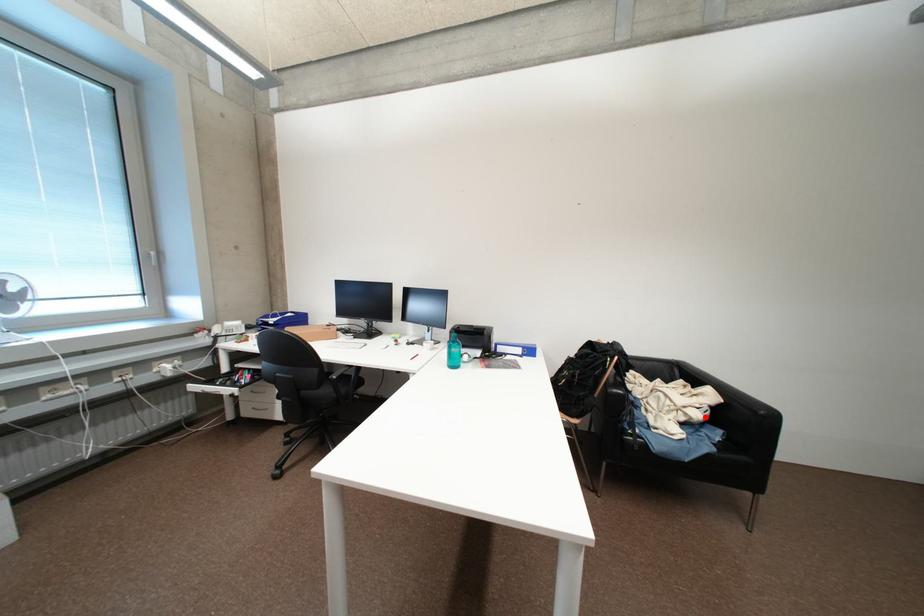
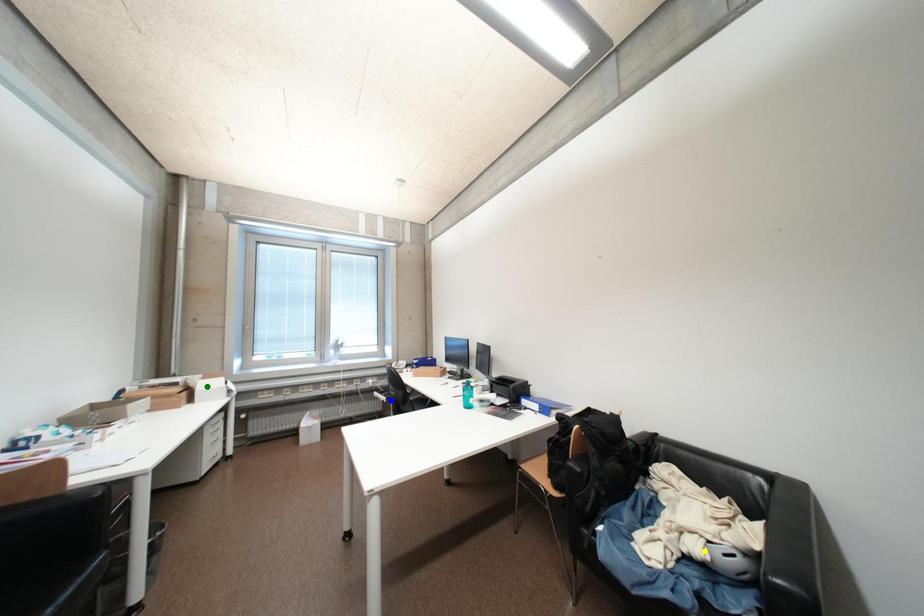
Question: I am providing you with two images of the same scene from different viewpoints. A red point is marked on the first image. You are given multiple points on the second image. Which point in image 2 represents the same 3d spot as the red point in image 1?

Choices:
 (A) yellow point
 (B) blue point
 (C) green point

Answer: (A)